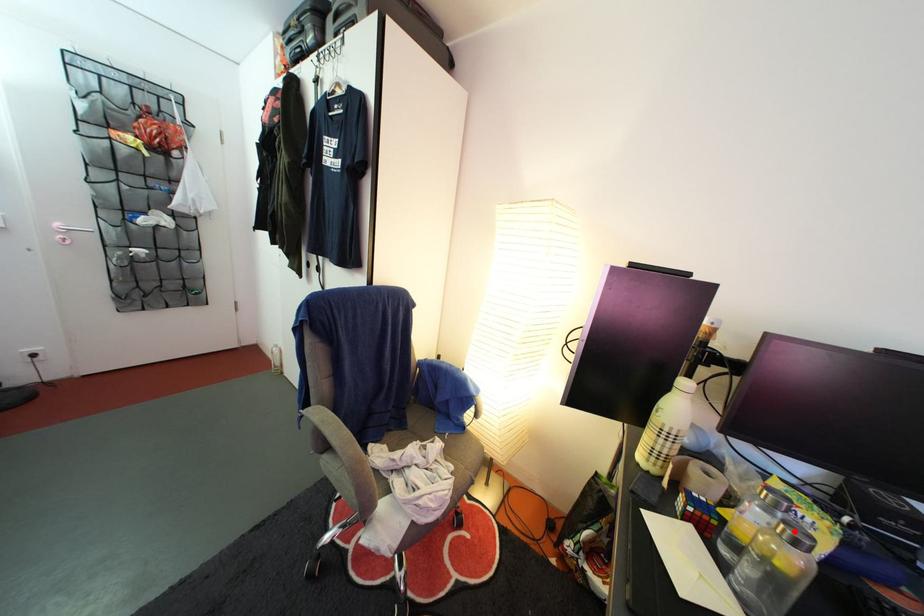
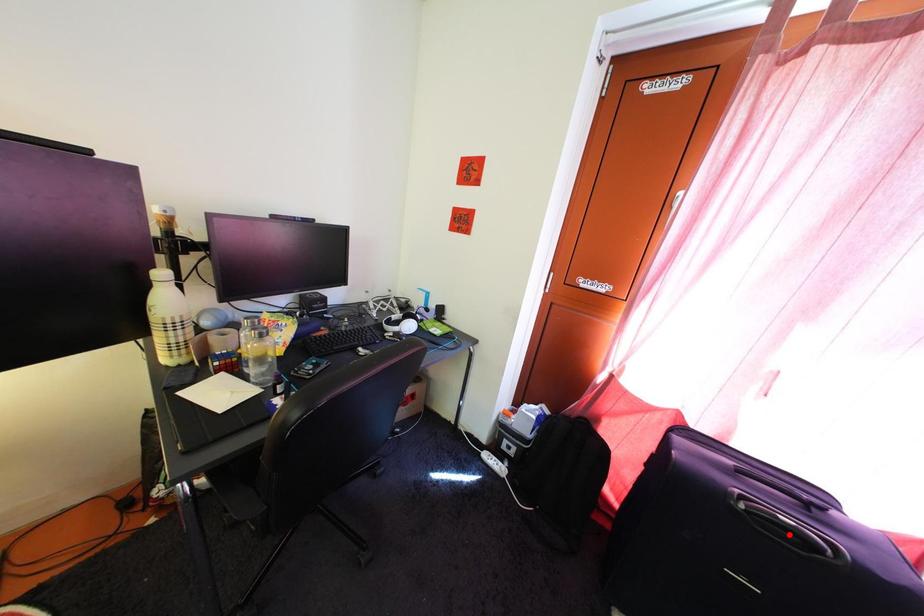
I am providing you with two images of the same scene from different viewpoints. A red point is marked on the first image and another point is marked on the second image. Is the marked point in image1 the same physical position as the marked point in image2?

No